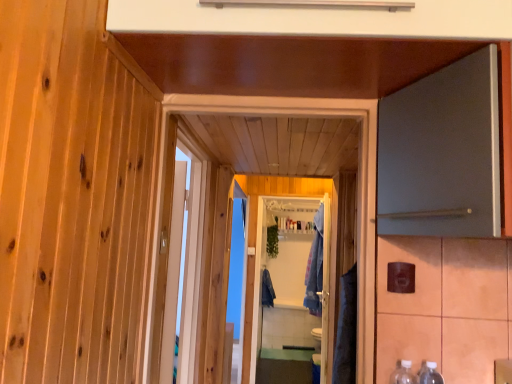
Measure the distance between dark blue fabric at center, acting as the 2th robe starting from the front, and camera.

5.11 meters.

Describe the element at coordinates (403, 373) in the screenshot. I see `clear plastic bottles at lower right, which is counted as the first bottle, starting from the left` at that location.

Measure the distance between point [399,362] and camera.

Point [399,362] is 1.34 meters from camera.

The height and width of the screenshot is (384, 512). Identify the location of matte gray cabinet at right, which appears as the 2th door when viewed from the left. (442, 153).

Measure the distance between denim robe at center, the second robe in the left-to-right sequence, and camera.

The distance of denim robe at center, the second robe in the left-to-right sequence, from camera is 3.82 meters.

Identify the location of dark blue fabric at center, acting as the 2th robe starting from the front. (267, 290).

From the image's perspective, is white wooden door at center, positioned as the 1th door in left-to-right order, positioned above or below denim robe at center, which is the 1th robe from front to back?

white wooden door at center, positioned as the 1th door in left-to-right order, is above denim robe at center, which is the 1th robe from front to back.

Which is behind, white wooden door at center, marked as the second door in a right-to-left arrangement, or denim robe at center, which is the 1th robe from front to back?

denim robe at center, which is the 1th robe from front to back, is behind.

Is white wooden door at center, positioned as the 1th door in left-to-right order, facing towards denim robe at center, the second robe in the left-to-right sequence?

No, white wooden door at center, positioned as the 1th door in left-to-right order, is not aimed at denim robe at center, the second robe in the left-to-right sequence.

Is denim robe at center, which is the 1th robe from front to back, surrounded by white wooden door at center, positioned as the 1th door in left-to-right order?

No, denim robe at center, which is the 1th robe from front to back, is not inside white wooden door at center, positioned as the 1th door in left-to-right order.

Is denim robe at center, which is the 1th robe from front to back, positioned behind white wooden door at center, marked as the second door in a right-to-left arrangement?

That is True.

Considering the positions of objects denim robe at center, which ranks as the second robe in back-to-front order, and white wooden door at center, marked as the second door in a right-to-left arrangement, in the image provided, who is more to the right, denim robe at center, which ranks as the second robe in back-to-front order, or white wooden door at center, marked as the second door in a right-to-left arrangement,?

denim robe at center, which ranks as the second robe in back-to-front order, is more to the right.

Considering the positions of point (304, 303) and point (205, 108), is point (304, 303) closer or farther from the camera than point (205, 108)?

Clearly, point (304, 303) is more distant from the camera than point (205, 108).

Which is more to the right, clear plastic bottles at lower right, which is counted as the first bottle, starting from the left, or denim robe at center, which ranks as the second robe in back-to-front order?

denim robe at center, which ranks as the second robe in back-to-front order, is more to the right.

Does clear plastic bottles at lower right, arranged as the second bottle when viewed from the right, lie in front of denim robe at center, the 1th robe viewed from the right?

That is True.

Which of these two, clear plastic bottles at lower right, arranged as the second bottle when viewed from the right, or denim robe at center, which ranks as the second robe in back-to-front order, stands taller?

With more height is denim robe at center, which ranks as the second robe in back-to-front order.

Between dark blue fabric at center, acting as the 2th robe starting from the front, and white glossy screen door at center, which one has less height?

Standing shorter between the two is dark blue fabric at center, acting as the 2th robe starting from the front.

Which of these two, dark blue fabric at center, the 1th robe in the left-to-right sequence, or white glossy screen door at center, is wider?

dark blue fabric at center, the 1th robe in the left-to-right sequence, is wider.

From the image's perspective, which one is positioned lower, dark blue fabric at center, the 1th robe in the left-to-right sequence, or white glossy screen door at center?

dark blue fabric at center, the 1th robe in the left-to-right sequence, appears lower in the image.

Would you say white glossy screen door at center is part of dark blue fabric at center, the first robe viewed from the back,'s contents?

Definitely not — white glossy screen door at center is not inside dark blue fabric at center, the first robe viewed from the back.

Is matte gray cabinet at right, which appears as the 2th door when viewed from the left, next to white wooden door at center, marked as the second door in a right-to-left arrangement?

matte gray cabinet at right, which appears as the 2th door when viewed from the left, and white wooden door at center, marked as the second door in a right-to-left arrangement, are not in contact.

Based on their sizes in the image, would you say matte gray cabinet at right, which appears as the 2th door when viewed from the left, is bigger or smaller than white wooden door at center, positioned as the 1th door in left-to-right order?

matte gray cabinet at right, which appears as the 2th door when viewed from the left, is bigger than white wooden door at center, positioned as the 1th door in left-to-right order.

From a real-world perspective, is matte gray cabinet at right, arranged as the 1th door when viewed from the right, beneath white wooden door at center, marked as the second door in a right-to-left arrangement?

No, from a real-world perspective, matte gray cabinet at right, arranged as the 1th door when viewed from the right, is not under white wooden door at center, marked as the second door in a right-to-left arrangement.

In the image, is matte gray cabinet at right, which appears as the 2th door when viewed from the left, positioned in front of or behind white wooden door at center, positioned as the 1th door in left-to-right order?

matte gray cabinet at right, which appears as the 2th door when viewed from the left, is in front of white wooden door at center, positioned as the 1th door in left-to-right order.

Is matte gray cabinet at right, which appears as the 2th door when viewed from the left, bigger or smaller than clear plastic bottles at lower right, positioned as the second bottle in left-to-right order?

Clearly, matte gray cabinet at right, which appears as the 2th door when viewed from the left, is larger in size than clear plastic bottles at lower right, positioned as the second bottle in left-to-right order.

Does matte gray cabinet at right, which appears as the 2th door when viewed from the left, lie behind clear plastic bottles at lower right, positioned as the second bottle in left-to-right order?

No, the depth of matte gray cabinet at right, which appears as the 2th door when viewed from the left, is less than that of clear plastic bottles at lower right, positioned as the second bottle in left-to-right order.

Between point (482, 155) and point (426, 373), which one is positioned behind?

The point (426, 373) is farther from the camera.

From the image's perspective, between matte gray cabinet at right, arranged as the 1th door when viewed from the right, and clear plastic bottles at lower right, positioned as the second bottle in left-to-right order, which one is located above?

matte gray cabinet at right, arranged as the 1th door when viewed from the right.

Considering the relative positions of matte gray cabinet at right, arranged as the 1th door when viewed from the right, and dark blue fabric at center, the 1th robe in the left-to-right sequence, in the image provided, is matte gray cabinet at right, arranged as the 1th door when viewed from the right, to the right of dark blue fabric at center, the 1th robe in the left-to-right sequence, from the viewer's perspective?

Yes.

Which object is wider, matte gray cabinet at right, which appears as the 2th door when viewed from the left, or dark blue fabric at center, the first robe viewed from the back?

matte gray cabinet at right, which appears as the 2th door when viewed from the left, is wider.

Are matte gray cabinet at right, which appears as the 2th door when viewed from the left, and dark blue fabric at center, which is counted as the 2th robe, starting from the right, far apart?

matte gray cabinet at right, which appears as the 2th door when viewed from the left, is positioned a significant distance from dark blue fabric at center, which is counted as the 2th robe, starting from the right.

Image resolution: width=512 pixels, height=384 pixels. In order to click on the 2nd robe directly beneath the matte gray cabinet at right, arranged as the 1th door when viewed from the right (from a real-world perspective) in this screenshot , I will do `click(267, 290)`.

Locate an element on the screen. This screenshot has width=512, height=384. door that is on the left side of denim robe at center, the second robe in the left-to-right sequence is located at coordinates (358, 184).

Where is `door that is the 1st object located in front of the denim robe at center, the second robe in the left-to-right sequence`? door that is the 1st object located in front of the denim robe at center, the second robe in the left-to-right sequence is located at coordinates (358, 184).

Looking at the image, which one is located closer to denim robe at center, the second robe in the left-to-right sequence, clear plastic bottles at lower right, which is counted as the first bottle, starting from the left, or dark blue fabric at center, which is counted as the 2th robe, starting from the right?

The object closer to denim robe at center, the second robe in the left-to-right sequence, is dark blue fabric at center, which is counted as the 2th robe, starting from the right.

Based on the photo, looking at the image, which one is located closer to clear plastic bottles at lower right, which is the first bottle from right to left, white wooden door at center, marked as the second door in a right-to-left arrangement, or clear plastic bottles at lower right, which is counted as the first bottle, starting from the left?

Based on the image, clear plastic bottles at lower right, which is counted as the first bottle, starting from the left, appears to be nearer to clear plastic bottles at lower right, which is the first bottle from right to left.

When comparing their distances from denim robe at center, the 1th robe viewed from the right, does white glossy screen door at center or white wooden door at center, positioned as the 1th door in left-to-right order, seem further?

Among the two, white wooden door at center, positioned as the 1th door in left-to-right order, is located further to denim robe at center, the 1th robe viewed from the right.

From the image, which object appears to be nearer to clear plastic bottles at lower right, which is the first bottle from right to left, denim robe at center, which ranks as the second robe in back-to-front order, or clear plastic bottles at lower right, arranged as the second bottle when viewed from the right?

The object closer to clear plastic bottles at lower right, which is the first bottle from right to left, is clear plastic bottles at lower right, arranged as the second bottle when viewed from the right.

Consider the image. When comparing their distances from matte gray cabinet at right, which appears as the 2th door when viewed from the left, does white wooden door at center, marked as the second door in a right-to-left arrangement, or denim robe at center, which ranks as the second robe in back-to-front order, seem closer?

white wooden door at center, marked as the second door in a right-to-left arrangement, is closer to matte gray cabinet at right, which appears as the 2th door when viewed from the left.

Which object lies further to the anchor point white wooden door at center, positioned as the 1th door in left-to-right order, clear plastic bottles at lower right, which is counted as the first bottle, starting from the left, or white glossy screen door at center?

Based on the image, white glossy screen door at center appears to be further to white wooden door at center, positioned as the 1th door in left-to-right order.

Which object lies nearer to the anchor point clear plastic bottles at lower right, which is the first bottle from right to left, white glossy screen door at center or dark blue fabric at center, which is counted as the 2th robe, starting from the right?

Among the two, white glossy screen door at center is located nearer to clear plastic bottles at lower right, which is the first bottle from right to left.

Which object lies nearer to the anchor point clear plastic bottles at lower right, positioned as the second bottle in left-to-right order, white glossy screen door at center or clear plastic bottles at lower right, which is counted as the first bottle, starting from the left?

clear plastic bottles at lower right, which is counted as the first bottle, starting from the left.

Find the location of `door between clear plastic bottles at lower right, arranged as the second bottle when viewed from the right, and dark blue fabric at center, acting as the 2th robe starting from the front, along the z-axis`. door between clear plastic bottles at lower right, arranged as the second bottle when viewed from the right, and dark blue fabric at center, acting as the 2th robe starting from the front, along the z-axis is located at coordinates (358, 184).

Where is `door between matte gray cabinet at right, arranged as the 1th door when viewed from the right, and white glossy screen door at center, along the z-axis`? This screenshot has width=512, height=384. door between matte gray cabinet at right, arranged as the 1th door when viewed from the right, and white glossy screen door at center, along the z-axis is located at coordinates (358, 184).

Locate an element on the screen. robe located between white wooden door at center, positioned as the 1th door in left-to-right order, and dark blue fabric at center, which is counted as the 2th robe, starting from the right, in the depth direction is located at coordinates (315, 267).

The image size is (512, 384). Find the location of `screen door located between clear plastic bottles at lower right, arranged as the second bottle when viewed from the right, and dark blue fabric at center, which is counted as the 2th robe, starting from the right, in the depth direction`. screen door located between clear plastic bottles at lower right, arranged as the second bottle when viewed from the right, and dark blue fabric at center, which is counted as the 2th robe, starting from the right, in the depth direction is located at coordinates (286, 300).